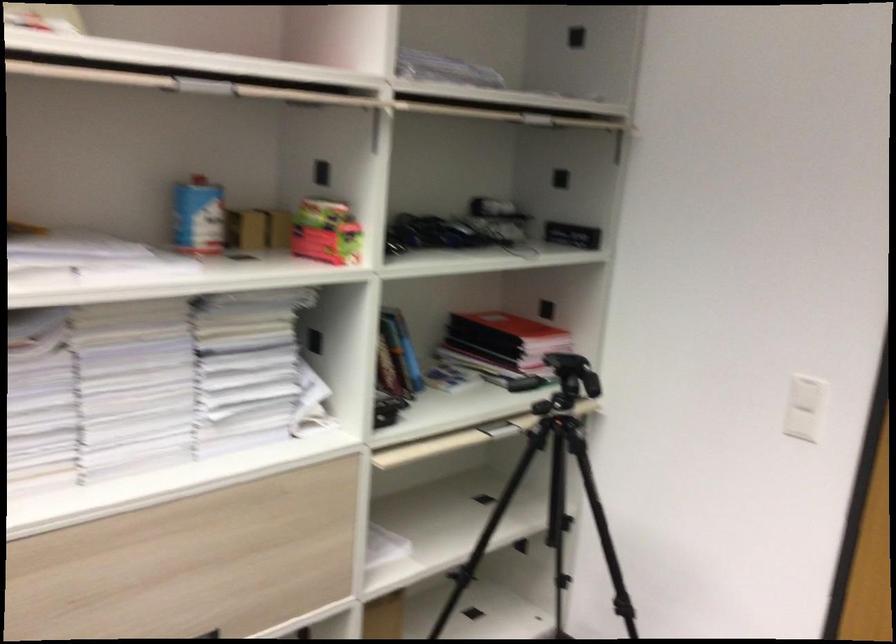
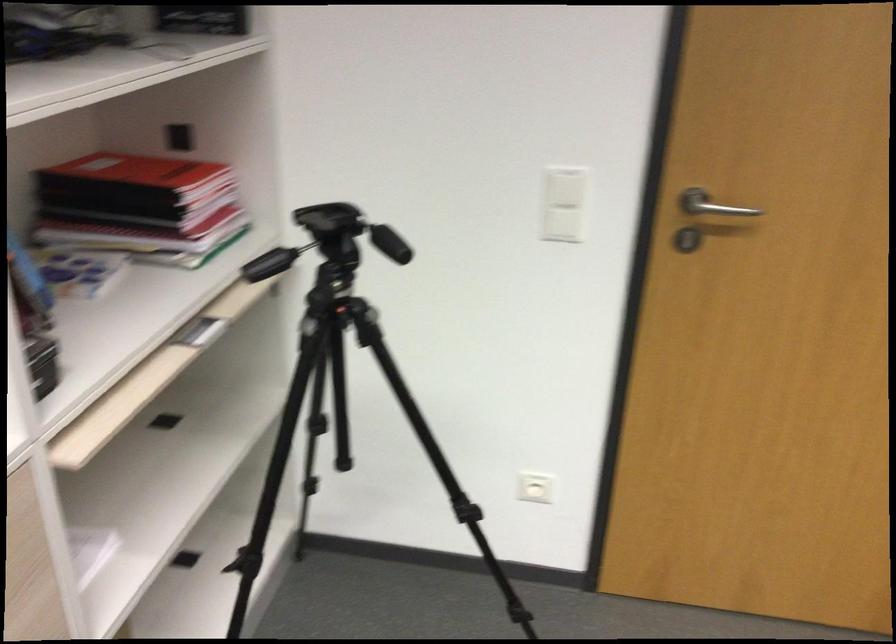
In the second image, find the point that corresponds to [510,317] in the first image.

(133, 172)